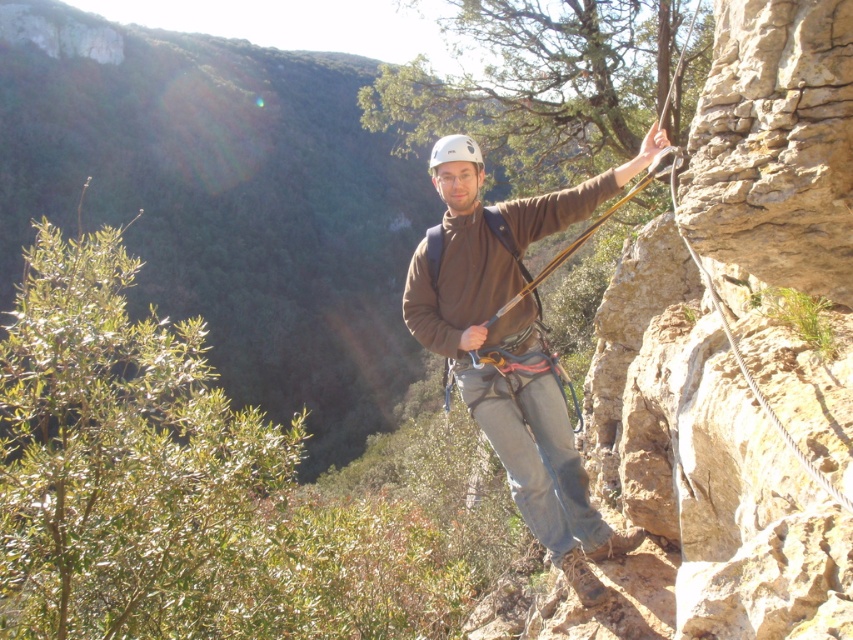
You are a climber trying to reach the top of the rock face. You see two points on the rock face labeled as point (515, 420) and point (460, 208). Which point should you grab first to progress upward?

You should grab point (460, 208) first because point (515, 420) is behind it, so reaching the closer point will allow you to move upward more effectively.

You are a photographer taking a picture of the climber. You notice the brown fabric jacket at center and the white matte helmet at center. Which object should you focus on if you want to capture the smaller one in the scene?

The brown fabric jacket at center is smaller than the white matte helmet at center, so you should focus on the brown fabric jacket at center to capture the smaller one.